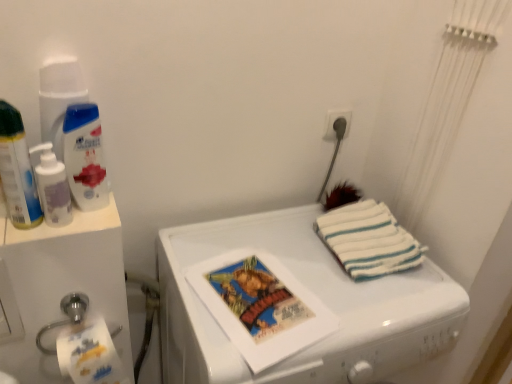
Question: From a real-world perspective, is white glossy shampoo at upper left, acting as the 2th cleaning product starting from the left, below white striped towel at right?

Choices:
 (A) yes
 (B) no

Answer: (B)

Question: From the image's perspective, would you say white glossy shampoo at upper left, which is the first cleaning product in right-to-left order, is positioned over white striped towel at right?

Choices:
 (A) yes
 (B) no

Answer: (A)

Question: Is white glossy shampoo at upper left, which is the first cleaning product in right-to-left order, thinner than white striped towel at right?

Choices:
 (A) no
 (B) yes

Answer: (B)

Question: Is white glossy shampoo at upper left, which is the first cleaning product in right-to-left order, far from white striped towel at right?

Choices:
 (A) no
 (B) yes

Answer: (A)

Question: Is white glossy shampoo at upper left, which is the first cleaning product in right-to-left order, positioned before white striped towel at right?

Choices:
 (A) yes
 (B) no

Answer: (A)

Question: Considering the positions of matte plastic spray can at left and white plastic water cooler at left in the image, is matte plastic spray can at left wider or thinner than white plastic water cooler at left?

Choices:
 (A) thin
 (B) wide

Answer: (A)

Question: From a real-world perspective, is matte plastic spray can at left above or below white plastic water cooler at left?

Choices:
 (A) below
 (B) above

Answer: (B)

Question: Is matte plastic spray can at left in front of or behind white plastic water cooler at left in the image?

Choices:
 (A) front
 (B) behind

Answer: (A)

Question: Considering the relative positions of matte plastic spray can at left and white plastic water cooler at left in the image provided, is matte plastic spray can at left to the left or to the right of white plastic water cooler at left?

Choices:
 (A) right
 (B) left

Answer: (A)

Question: Is white striped towel at right bigger or smaller than white glossy washing machine at center?

Choices:
 (A) big
 (B) small

Answer: (B)

Question: From a real-world perspective, is white striped towel at right positioned above or below white glossy washing machine at center?

Choices:
 (A) above
 (B) below

Answer: (A)

Question: Considering their positions, is white striped towel at right located in front of or behind white glossy washing machine at center?

Choices:
 (A) front
 (B) behind

Answer: (B)

Question: In the image, is white striped towel at right on the left side or the right side of white glossy washing machine at center?

Choices:
 (A) right
 (B) left

Answer: (A)

Question: In terms of width, does white glossy washing machine at center look wider or thinner when compared to white plastic socket at upper right?

Choices:
 (A) wide
 (B) thin

Answer: (A)

Question: Is point (160, 248) closer or farther from the camera than point (326, 137)?

Choices:
 (A) farther
 (B) closer

Answer: (B)